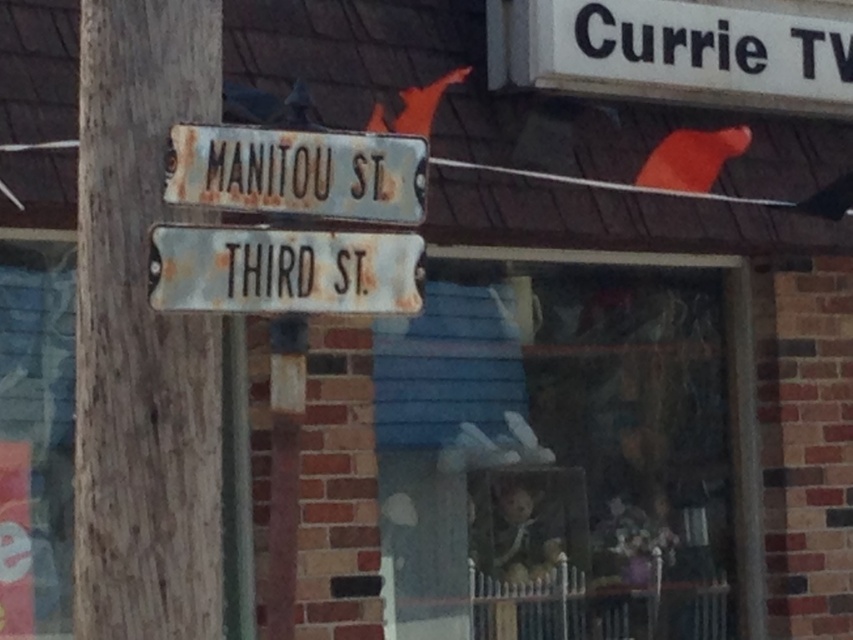
Consider the image. Does rusty metal street sign at center have a greater height compared to rusty metal pole at left?

No, rusty metal street sign at center is not taller than rusty metal pole at left.

Can you confirm if rusty metal street sign at center is positioned below rusty metal pole at left?

Actually, rusty metal street sign at center is above rusty metal pole at left.

Where is `rusty metal street sign at center`? The height and width of the screenshot is (640, 853). rusty metal street sign at center is located at coordinates click(283, 269).

You are a GUI agent. You are given a task and a screenshot of the screen. Output one action in this format:
    pyautogui.click(x=<x>, y=<y>)
    Task: Click on the rusty metal street sign at center
    
    Given the screenshot: What is the action you would take?
    pyautogui.click(x=283, y=269)

Can you confirm if blue wooden fence at center is thinner than rusty metal street sign at center?

No.

Identify the location of blue wooden fence at center. The image size is (853, 640). (556, 440).

Is rusty metal street sign at upper center taller than rusty metal pole at left?

In fact, rusty metal street sign at upper center may be shorter than rusty metal pole at left.

Does rusty metal street sign at upper center have a lesser height compared to rusty metal pole at left?

Correct, rusty metal street sign at upper center is not as tall as rusty metal pole at left.

Where is `rusty metal street sign at upper center`? The width and height of the screenshot is (853, 640). rusty metal street sign at upper center is located at coordinates (299, 172).